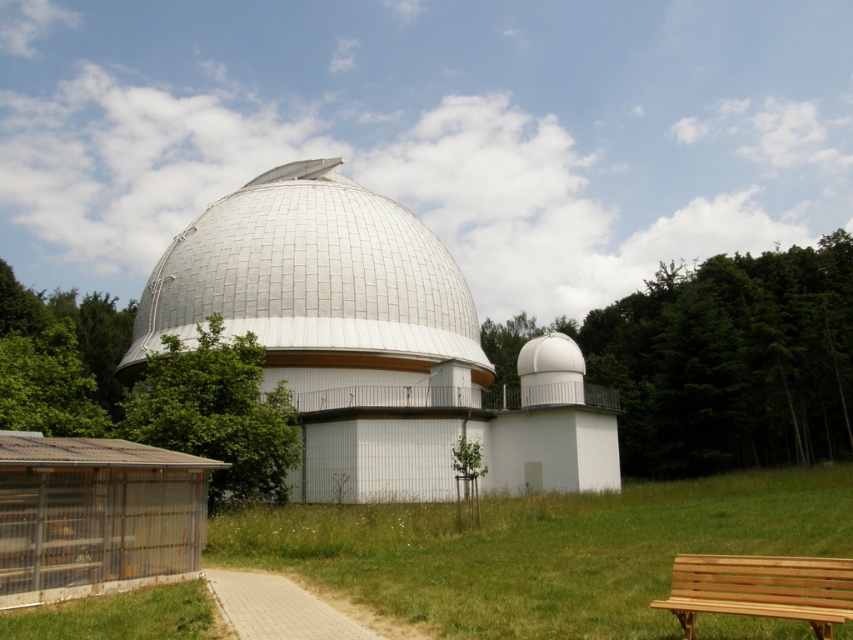
You are standing at the camera position and want to reach the point marked at coordinates (515, 314). The path you need to take is 170.99 meters long. Is this path longer than 150 meters?

Yes, the path to the point marked at coordinates (515, 314) is 170.99 meters long, which is longer than 150 meters.

Consider the image. You are standing at the entrance of the observatory and see two points marked on the pathway leading to the main building. The first point is at coordinates point (535, 506) and the second is at point (595, 321). Which point is nearer to you as you stand at the entrance?

Point (535, 506) is closer to the viewer than point (595, 321), so the first point is nearer to you as you stand at the entrance.

From the picture: You are a visitor approaching the observatory and see the white matte observatory at center and the green leafy tree at left. Which object is closer to the entrance of the observatory?

The white matte observatory at center is closer to the entrance of the observatory than the green leafy tree at left because it is positioned on the right side of the tree, implying it is near the entrance path.